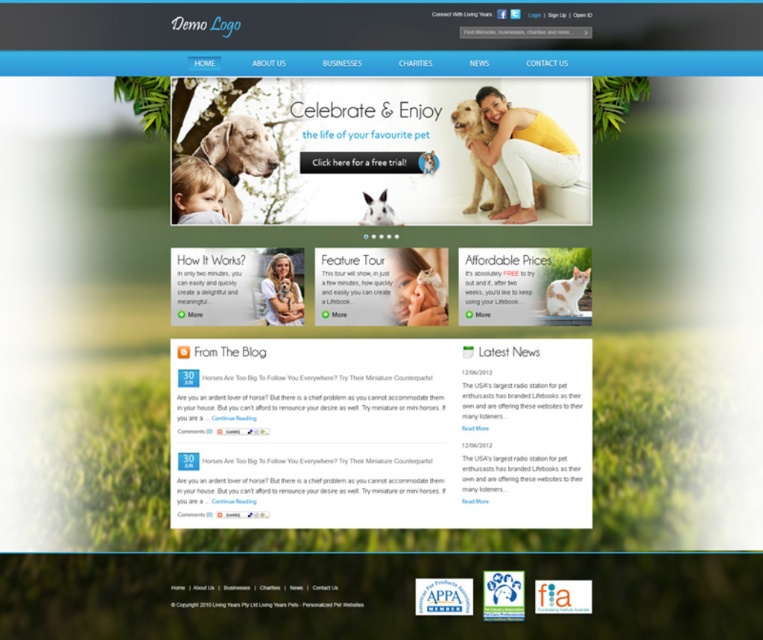
You are designing a webpage and need to ensure that the golden fur dog at center and the white fur dog at right are both visible. Based on their positions, which dog is placed in front of the other?

The golden fur dog at center is positioned over white fur dog at right, so it is placed in front.

You are designing a webpage and want to ensure that the matte gray dog at upper left and the white fur dog at center are spaced at least 12 inches apart for better visual separation. Based on the current layout, do they meet this requirement?

The matte gray dog at upper left and the white fur dog at center are 11.71 inches apart from each other, which is less than the required 12 inches. Therefore, they do not meet the spacing requirement.